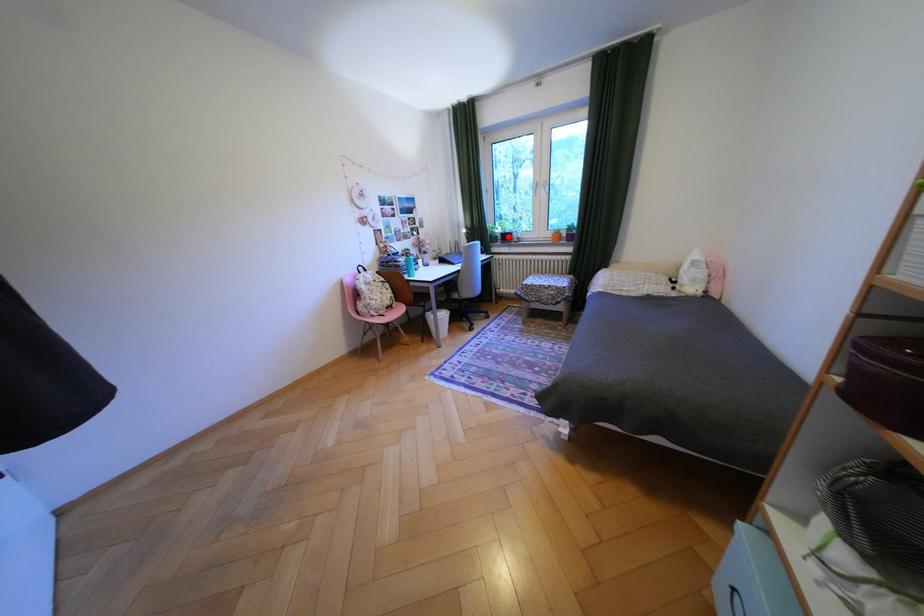
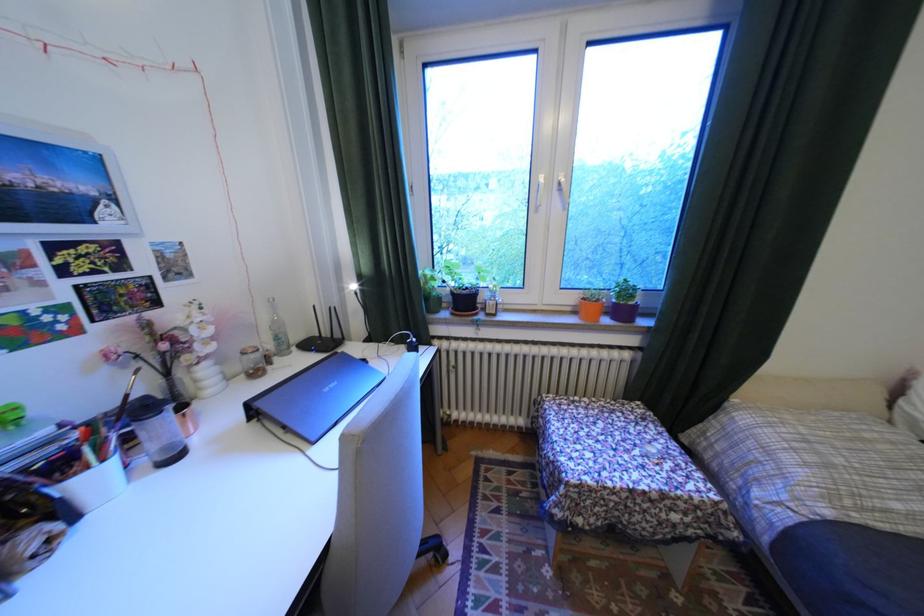
Question: I am providing you with two images of the same scene from different viewpoints. A red point is shown in image1. For the corresponding object point in image2, is it positioned nearer or farther from the camera?

Choices:
 (A) Nearer
 (B) Farther

Answer: (B)